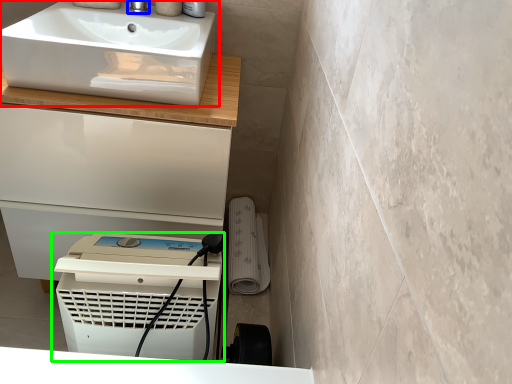
Question: Which object is the farthest from sink (highlighted by a red box)? Choose among these: tap (highlighted by a blue box) or home appliance (highlighted by a green box).

Choices:
 (A) tap
 (B) home appliance

Answer: (B)